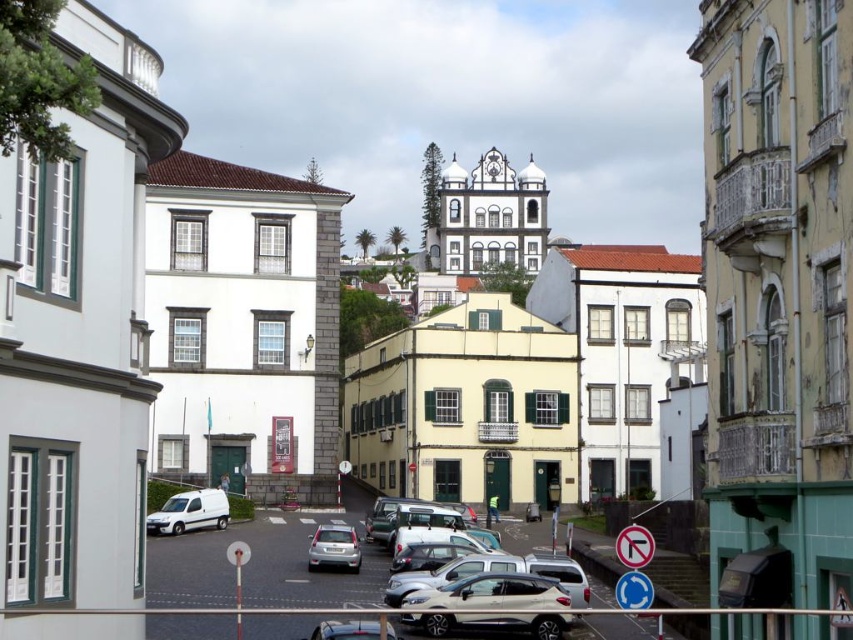
Question: Which object is closer to the camera taking this photo?

Choices:
 (A) satin silver car at center
 (B) metallic silver car at center

Answer: (B)

Question: Does satin silver suv at center have a lesser width compared to metallic silver car at center?

Choices:
 (A) yes
 (B) no

Answer: (A)

Question: Which of the following is the farthest from the observer?

Choices:
 (A) satin silver suv at center
 (B) silver metallic car at center

Answer: (B)

Question: Can you confirm if satin silver suv at center is positioned to the right of silver metallic car at center?

Choices:
 (A) yes
 (B) no

Answer: (A)

Question: Can you confirm if satin silver suv at center is smaller than white matte van at lower left?

Choices:
 (A) no
 (B) yes

Answer: (B)

Question: Considering the real-world distances, which object is closest to the metallic silver car at center?

Choices:
 (A) satin silver suv at center
 (B) white matte van at lower left
 (C) satin silver car at center

Answer: (A)